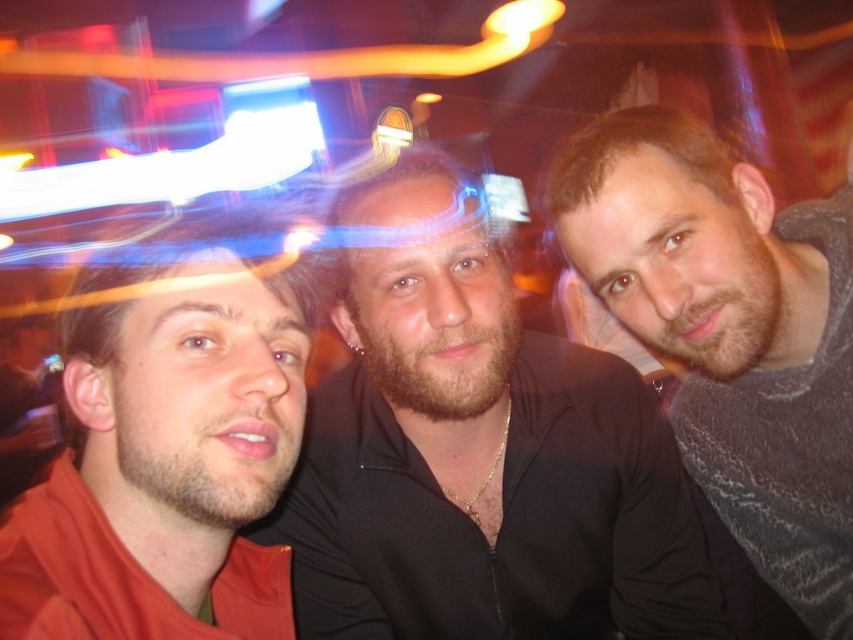
Question: Is matte orange shirt at left in front of gray textured hoodie at right?

Choices:
 (A) no
 (B) yes

Answer: (B)

Question: Among these points, which one is nearest to the camera?

Choices:
 (A) tap(653, 323)
 (B) tap(19, 579)

Answer: (B)

Question: Which of the following is the closest to the observer?

Choices:
 (A) gray textured hoodie at right
 (B) matte orange shirt at left

Answer: (B)

Question: Does smooth black shirt at center have a larger size compared to matte orange shirt at left?

Choices:
 (A) no
 (B) yes

Answer: (B)

Question: Does matte orange shirt at left have a greater width compared to gray textured hoodie at right?

Choices:
 (A) yes
 (B) no

Answer: (B)

Question: Which of the following is the farthest from the observer?

Choices:
 (A) (84, 330)
 (B) (795, 515)
 (C) (462, 260)

Answer: (B)